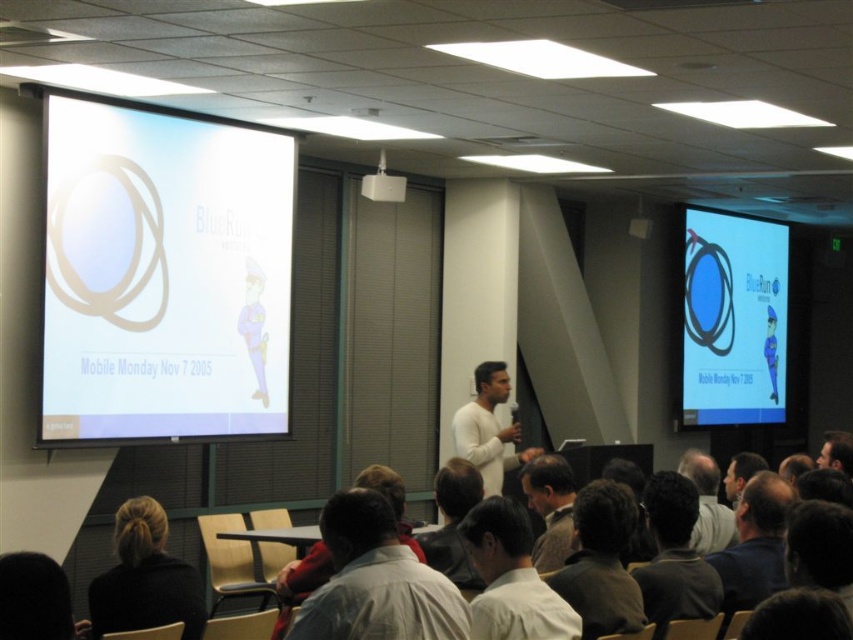
Question: Estimate the real-world distances between objects in this image. Which object is closer to the light brown shirt at center?

Choices:
 (A) dark blue shirt at lower right
 (B) dark gray shirt at lower right
 (C) white plastic projector at upper center
 (D) brown wool sweater at center

Answer: (B)

Question: Which is nearer to the light gray shirt at center?

Choices:
 (A) light brown hair at lower right
 (B) brown fabric shirt at lower right
 (C) white glossy projection screen at upper left

Answer: (B)

Question: Is blue glossy screen at upper right positioned before white matte shirt at center?

Choices:
 (A) no
 (B) yes

Answer: (A)

Question: Does white glossy projection screen at upper left have a smaller size compared to brown fabric shirt at lower right?

Choices:
 (A) yes
 (B) no

Answer: (B)

Question: Which point appears farthest from the camera in this image?

Choices:
 (A) (680, 497)
 (B) (432, 616)

Answer: (A)

Question: Can you confirm if white matte shirt at center is wider than light brown leather jacket at center?

Choices:
 (A) yes
 (B) no

Answer: (A)